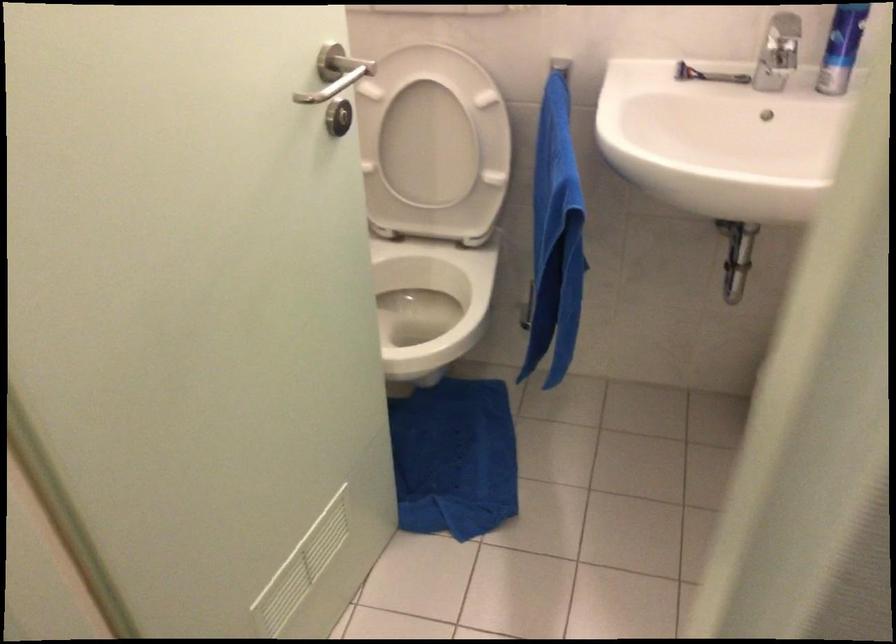
At what (x,y) coordinates should I click in order to perform the action: click on razor. Please return your answer as a coordinate pair (x, y). This screenshot has height=644, width=896. Looking at the image, I should click on (719, 144).